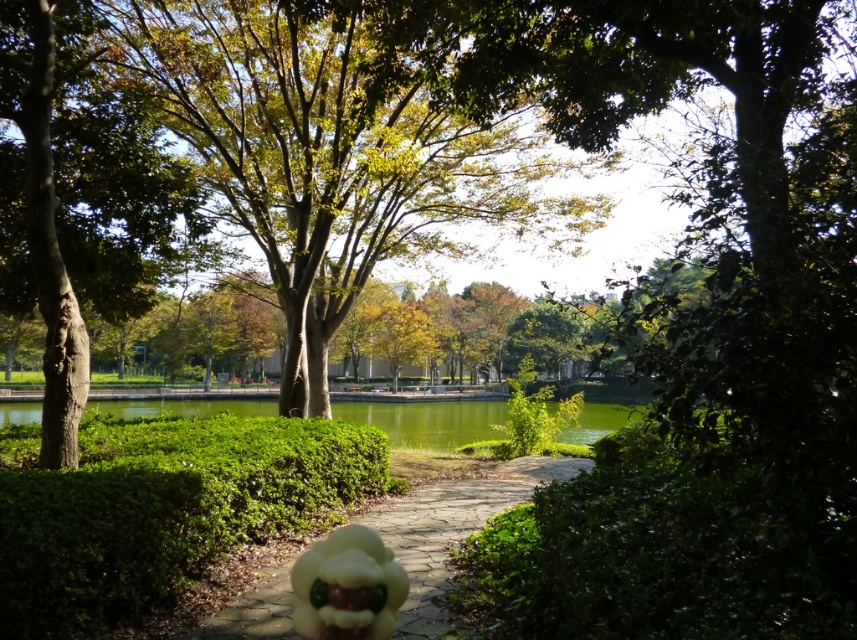
You are a park visitor who wants to place a new bench between the green leafy tree at center and the yellow matte plush at center. Which object should the bench be closer to if it needs to be placed near the smaller one?

The bench should be placed closer to the yellow matte plush at center because it is smaller than the green leafy tree at center.

You are a park visitor who wants to place a small decorative item on the ground between the green leafy hedge at center and the yellow matte plush at center. Which object should you stand closer to in order to ensure the item is centered between them?

The green leafy hedge at center is larger in size than the yellow matte plush at center, so to center the item between them, you should stand closer to the yellow matte plush at center.

You are a park visitor who wants to take a photo of the green leafy tree at center and the yellow rubber duck at center. Which object will appear bigger in your photo?

The green leafy tree at center will appear bigger in the photo because it has a larger size compared to the yellow rubber duck at center.